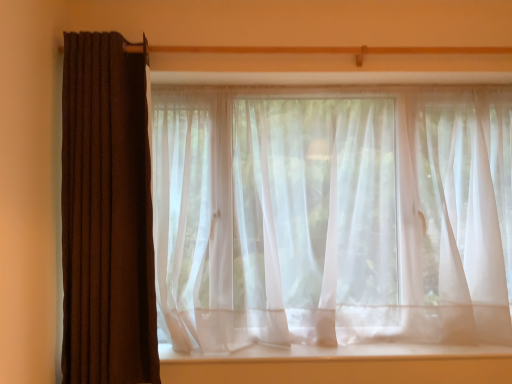
Question: Is white sheer fabric at center aimed at sheer white curtain at center, acting as the second curtain starting from the left?

Choices:
 (A) yes
 (B) no

Answer: (B)

Question: Is sheer white curtain at center, acting as the second curtain starting from the left, completely or partially inside white sheer fabric at center?

Choices:
 (A) yes
 (B) no

Answer: (B)

Question: Is white sheer fabric at center to the right of sheer white curtain at center, acting as the second curtain starting from the left, from the viewer's perspective?

Choices:
 (A) no
 (B) yes

Answer: (A)

Question: Can you confirm if white sheer fabric at center is shorter than sheer white curtain at center, the 1th curtain from the right?

Choices:
 (A) yes
 (B) no

Answer: (A)

Question: From the image's perspective, is white sheer fabric at center above sheer white curtain at center, acting as the second curtain starting from the left?

Choices:
 (A) yes
 (B) no

Answer: (B)

Question: Is brown textured curtain at left, which appears as the 2th curtain when viewed from the right, taller or shorter than sheer white curtain at center, the 1th curtain from the right?

Choices:
 (A) short
 (B) tall

Answer: (B)

Question: Considering the positions of brown textured curtain at left, which appears as the 2th curtain when viewed from the right, and sheer white curtain at center, acting as the second curtain starting from the left, in the image, is brown textured curtain at left, which appears as the 2th curtain when viewed from the right, wider or thinner than sheer white curtain at center, acting as the second curtain starting from the left,?

Choices:
 (A) wide
 (B) thin

Answer: (B)

Question: In the image, is brown textured curtain at left, which appears as the 2th curtain when viewed from the right, on the left side or the right side of sheer white curtain at center, acting as the second curtain starting from the left?

Choices:
 (A) right
 (B) left

Answer: (B)

Question: Choose the correct answer: Is brown textured curtain at left, which is the 1th curtain in left-to-right order, inside sheer white curtain at center, the 1th curtain from the right, or outside it?

Choices:
 (A) outside
 (B) inside

Answer: (A)

Question: From their relative heights in the image, would you say white sheer fabric at center is taller or shorter than sheer white curtain at center, the 1th curtain from the right?

Choices:
 (A) tall
 (B) short

Answer: (B)

Question: From a real-world perspective, is white sheer fabric at center physically located above or below sheer white curtain at center, the 1th curtain from the right?

Choices:
 (A) above
 (B) below

Answer: (B)

Question: From the image's perspective, relative to sheer white curtain at center, the 1th curtain from the right, is white sheer fabric at center above or below?

Choices:
 (A) above
 (B) below

Answer: (B)

Question: Is point (276, 355) closer or farther from the camera than point (266, 102)?

Choices:
 (A) farther
 (B) closer

Answer: (B)

Question: From a real-world perspective, is sheer white curtain at center, acting as the second curtain starting from the left, positioned above or below white sheer fabric at center?

Choices:
 (A) below
 (B) above

Answer: (B)

Question: Looking at the image, does sheer white curtain at center, the 1th curtain from the right, seem bigger or smaller compared to white sheer fabric at center?

Choices:
 (A) small
 (B) big

Answer: (B)